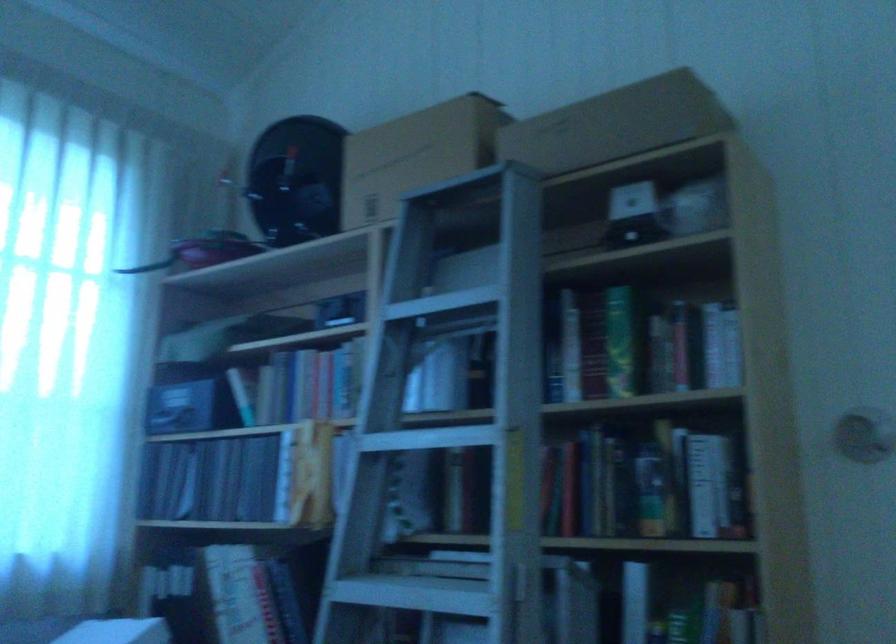
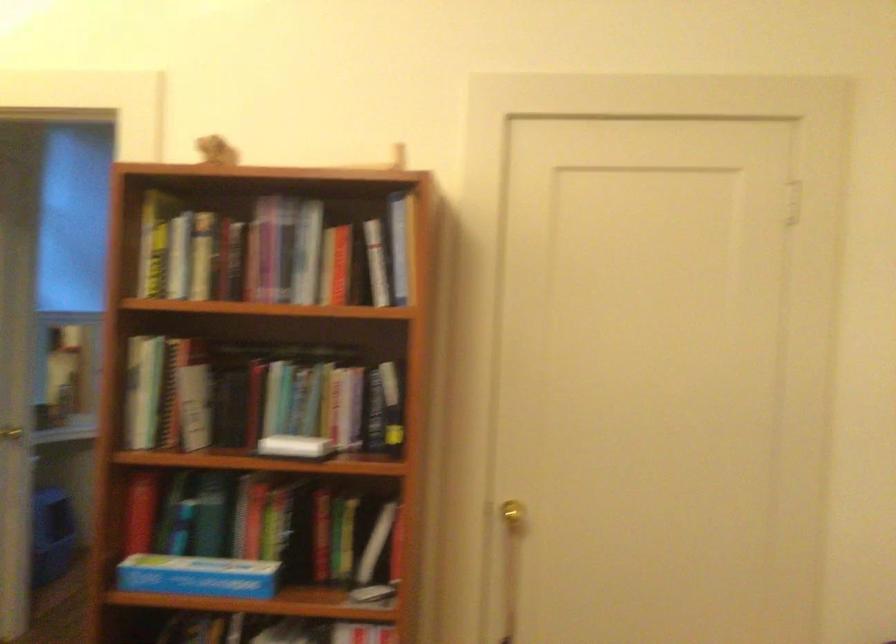
Question: I am providing you with two images of the same scene from different viewpoints. Please identify which objects are invisible in image2.

Choices:
 (A) book
 (B) silver door knob
 (C) ladder rung
 (D) blue folder

Answer: (C)